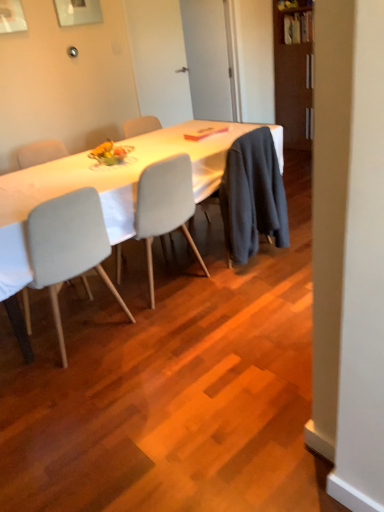
Find the location of `vacant space that is to the left of dark gray fabric robe at center`. vacant space that is to the left of dark gray fabric robe at center is located at coordinates (207, 252).